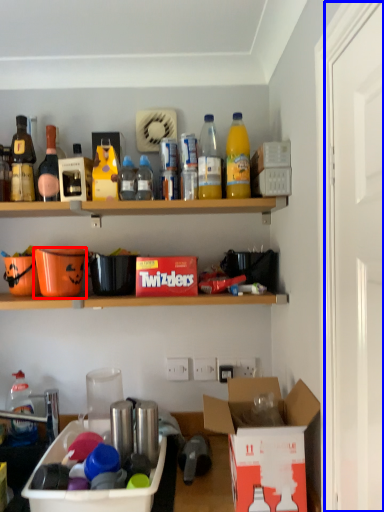
Question: Which of the following is the farthest to the observer, bucket (highlighted by a red box) or door (highlighted by a blue box)?

Choices:
 (A) bucket
 (B) door

Answer: (A)